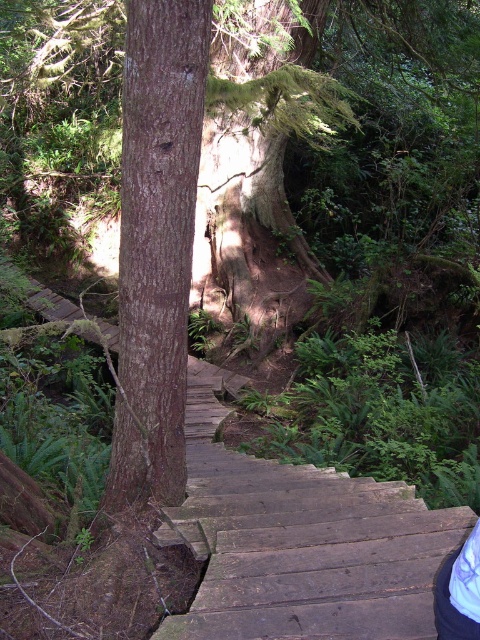
You are hiking and want to take a photo of both the wooden stairs at center and the brown rough bark tree at center. Which object should you position closer to the left side of your camera frame to include both in the shot?

The brown rough bark tree at center should be positioned closer to the left side of your camera frame because the wooden stairs at center is on its right side.

You are standing at the base of the wooden staircase in the forest scene. There is a point marked at coordinates (299,541). Based on the scene description, can you determine if this point is located on the wooden staircase or somewhere else?

The point at (299,541) is on the wooden stairs at center, so yes, it is located on the wooden staircase.

You are a hiker who wants to reach the brown rough bark tree at center from the wooden stairs at center. Which direction should you go?

The wooden stairs at center is below the brown rough bark tree at center, so you should go upwards to reach the brown rough bark tree at center.